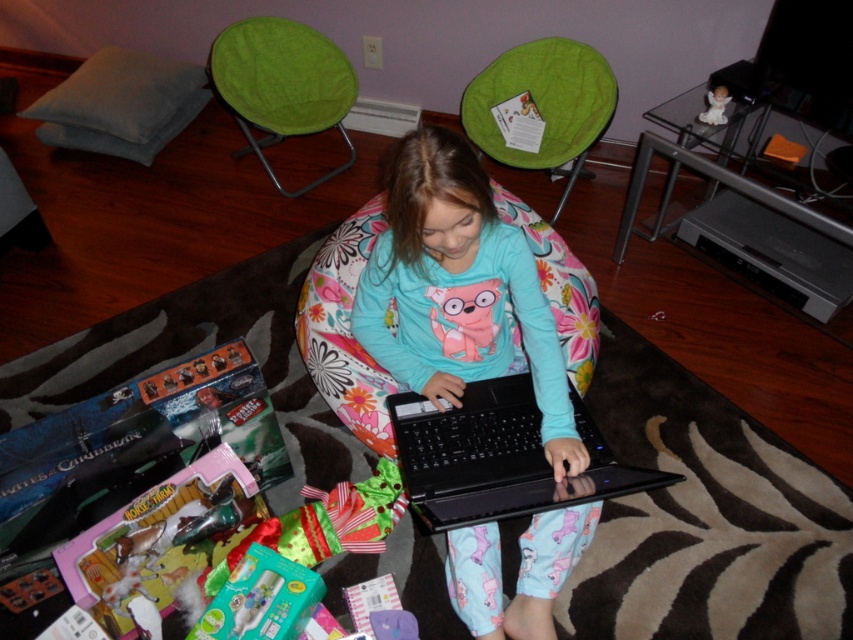
You are a delivery person who needs to place a new package on the floor between the matte blue fabric at center and the floral fabric bean bag at center. The package is 1.2 meters wide. Can you fit it there?

The matte blue fabric at center is wider than the floral fabric bean bag at center. Therefore, the space between them may not be sufficient for a package 1.2 meters wide. You should measure the exact distance to ensure it fits.

From the picture: You are the girl in the image and you want to reach for your black plastic laptop at center and teal plastic toothbrush at lower center. Which object is closer to your right hand?

The black plastic laptop at center is closer to your right hand because it is positioned to the right of the teal plastic toothbrush at lower center.